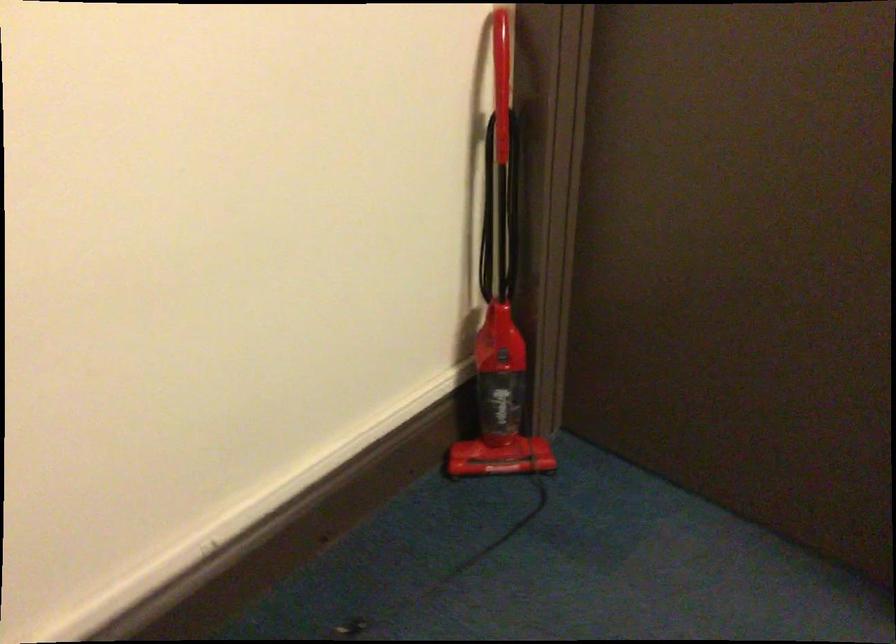
Describe the element at coordinates (501, 78) in the screenshot. This screenshot has width=896, height=644. I see `the red vacuum handle` at that location.